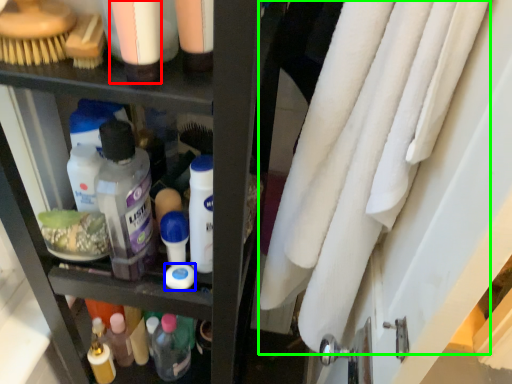
Question: Which object is the farthest from toiletry (highlighted by a red box)? Choose among these: product (highlighted by a blue box) or bath towel (highlighted by a green box).

Choices:
 (A) product
 (B) bath towel

Answer: (A)